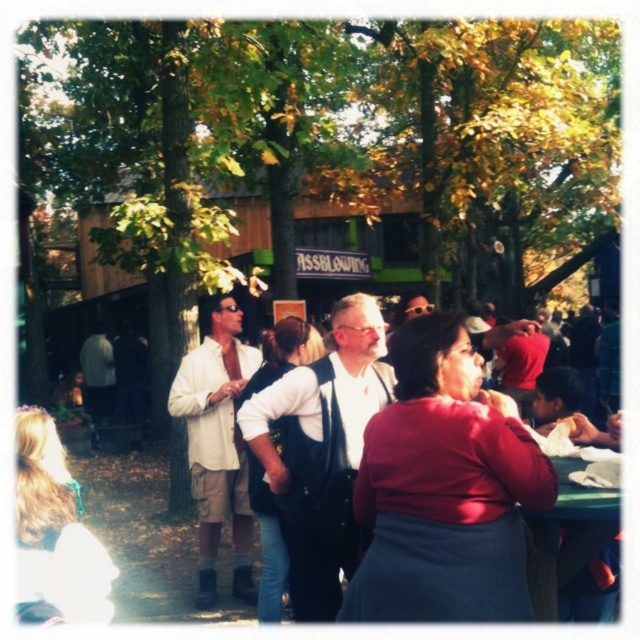
Who is positioned more to the left, green leafy tree at center or matte red shirt at center?

From the viewer's perspective, green leafy tree at center appears more on the left side.

From the picture: Is green leafy tree at center closer to camera compared to matte red shirt at center?

No, green leafy tree at center is further to the viewer.

Where is `green leafy tree at center`? Image resolution: width=640 pixels, height=640 pixels. green leafy tree at center is located at coordinates (337, 140).

At what (x,y) coordinates should I click in order to perform the action: click on green leafy tree at center. Please return your answer as a coordinate pair (x, y). Looking at the image, I should click on (337, 140).

Does white cotton shirt at center appear on the right side of blonde hair at center?

Indeed, white cotton shirt at center is positioned on the right side of blonde hair at center.

Is white cotton shirt at center to the left of blonde hair at center from the viewer's perspective?

Incorrect, white cotton shirt at center is not on the left side of blonde hair at center.

Where is `white cotton shirt at center`? Image resolution: width=640 pixels, height=640 pixels. white cotton shirt at center is located at coordinates (218, 444).

Identify the location of white cotton shirt at center. (218, 444).

Is green leafy tree at center shorter than matte black vest at center?

Incorrect, green leafy tree at center's height does not fall short of matte black vest at center's.

Which is above, green leafy tree at center or matte black vest at center?

green leafy tree at center

Identify the location of green leafy tree at center. The width and height of the screenshot is (640, 640). (337, 140).

This screenshot has height=640, width=640. Identify the location of green leafy tree at center. (337, 140).